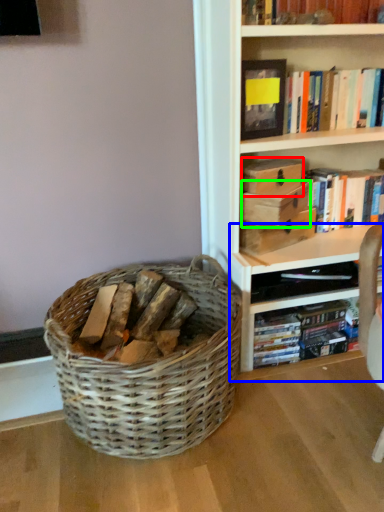
Question: Based on their relative distances, which object is farther from storage box (highlighted by a red box)? Choose from shelf (highlighted by a blue box) and storage box (highlighted by a green box).

Choices:
 (A) shelf
 (B) storage box

Answer: (A)